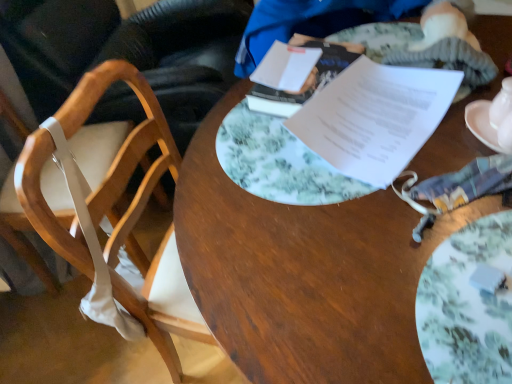
Question: From the image's perspective, is porcelain floral plate at center located above or below wooden desk at center?

Choices:
 (A) above
 (B) below

Answer: (A)

Question: Relative to wooden desk at center, is porcelain floral plate at center in front or behind?

Choices:
 (A) behind
 (B) front

Answer: (B)

Question: Estimate the real-world distances between objects in this image. Which object is farther from the white paper at center, which is the second journal from back to front?

Choices:
 (A) porcelain floral plate at center
 (B) white paper at upper center, which ranks as the 2th journal in front-to-back order
 (C) white ceramic saucer at right
 (D) white glossy teapot at upper right
 (E) white fabric chair at left, arranged as the second chair when viewed from the left

Answer: (E)

Question: Which is farther from the white fabric chair at left, arranged as the second chair when viewed from the left?

Choices:
 (A) white ceramic saucer at right
 (B) white glossy teapot at upper right
 (C) wooden chair at left, which is the 1th chair from left to right
 (D) white paper at upper center, marked as the 1th journal in a back-to-front arrangement
 (E) white paper at center, marked as the 1th journal in a front-to-back arrangement

Answer: (B)